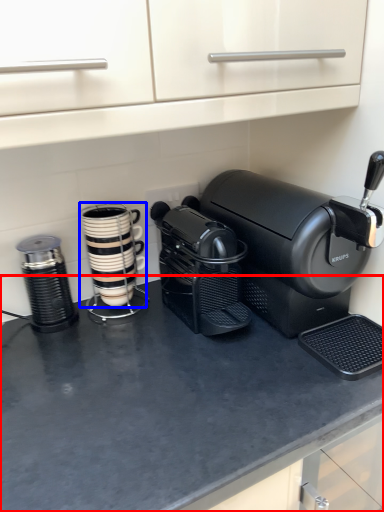
Question: Which object is further to the camera taking this photo, counter top (highlighted by a red box) or kitchen appliance (highlighted by a blue box)?

Choices:
 (A) counter top
 (B) kitchen appliance

Answer: (B)